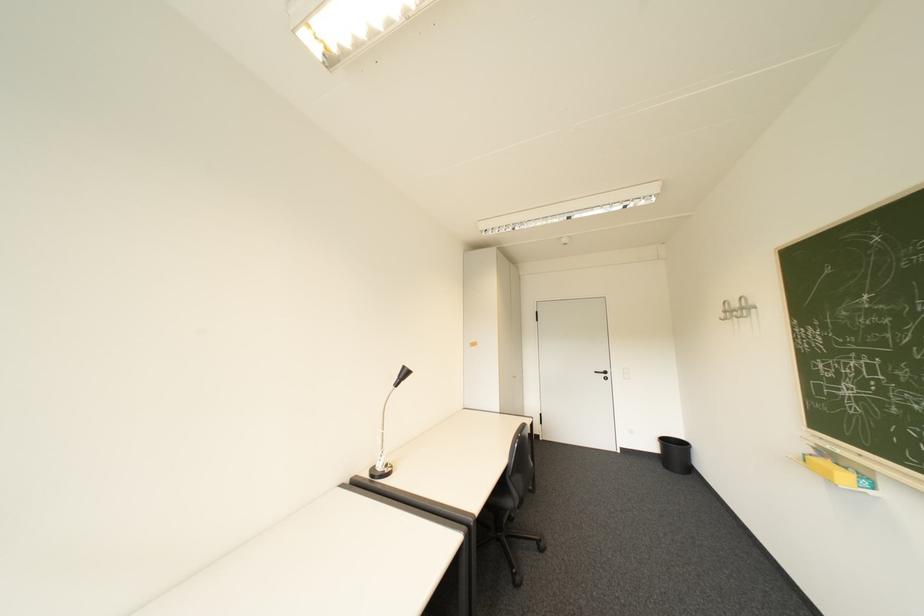
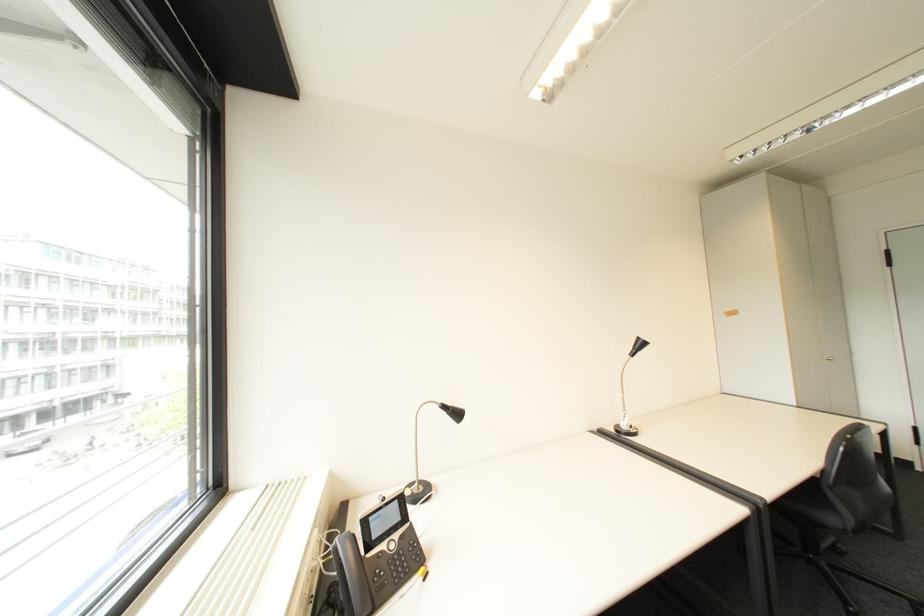
The point at (517, 538) is marked in the first image. Where is the corresponding point in the second image?

(840, 567)